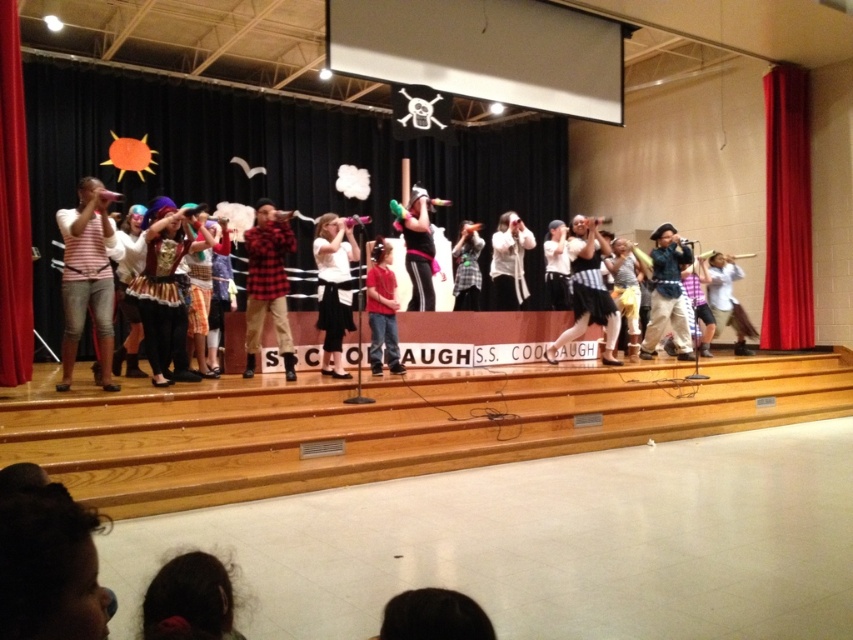
You are a photographer standing at the back of the gymnasium. You want to take a clear photo of the red plaid shirt at center. Considering the distance, can you capture it without zooming?

The red plaid shirt at center is 19.96 feet away from the camera. Since typical cameras can focus clearly up to 20 feet without zooming, you can capture it clearly without needing to zoom.

You are a photographer standing behind the stage. You want to take a photo of the red plaid shirt at center and the dark brown hair at lower center. The camera you are using has a maximum focus range of 5 meters. Will both subjects be in focus?

The red plaid shirt at center is 5.30 meters away from dark brown hair at lower center. Since the camera can only focus up to 5 meters, the distance between them exceeds the focus range. Therefore, both subjects cannot be in focus simultaneously.